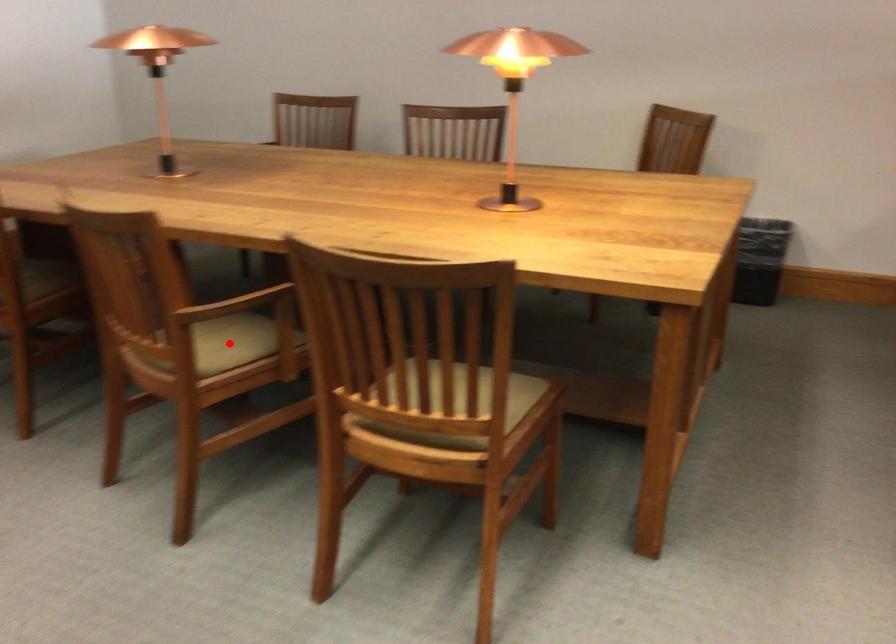
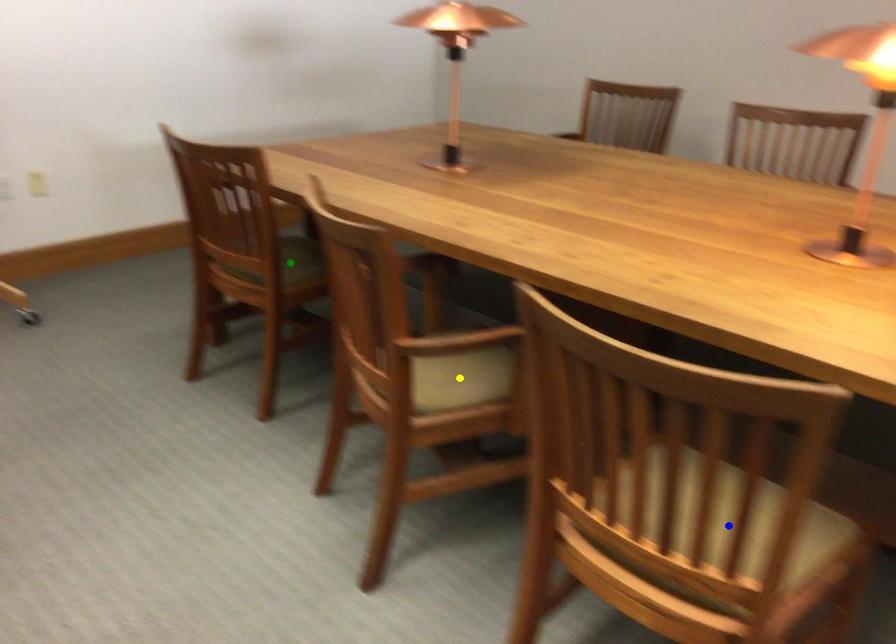
Question: I am providing you with two images of the same scene from different viewpoints. A red point is marked on the first image. You are given multiple points on the second image. Which point in image 2 is actually the same real-world point as the red point in image 1?

Choices:
 (A) yellow point
 (B) green point
 (C) blue point

Answer: (A)